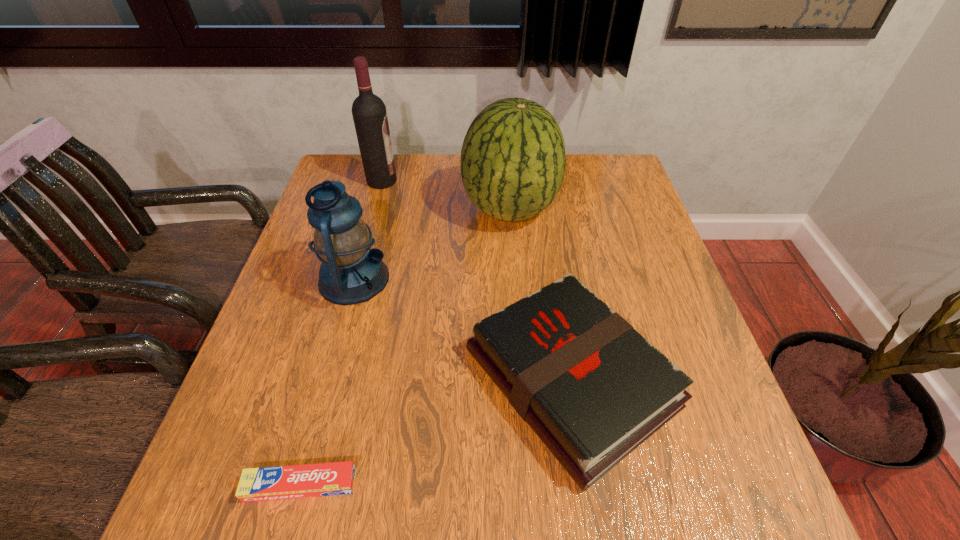
The height and width of the screenshot is (540, 960). I want to click on vacant area that lies between the fourth tallest object and the wine bottle, so click(x=476, y=280).

Find the location of a particular element. This screenshot has width=960, height=540. vacant area that lies between the shortest object and the wine bottle is located at coordinates (342, 333).

Identify the location of vacant space in between the watermelon and the lantern. tap(432, 245).

I want to click on free area in between the shortest object and the hardback book, so click(x=436, y=432).

What are the coordinates of `free space between the wine bottle and the shortest object` in the screenshot? It's located at (342, 333).

Locate which object is the fourth closest to the lantern. Please provide its 2D coordinates. Your answer should be formatted as a tuple, i.e. [(x, y)], where the tuple contains the x and y coordinates of a point satisfying the conditions above.

[(336, 478)]

Where is `the second closest object relative to the second shortest object`? the second closest object relative to the second shortest object is located at coordinates (351, 272).

Identify the location of vacant space that satisfies the following two spatial constraints: 1. on the face of the lantern; 2. on the left side of the toothpaste. (298, 485).

I want to click on free space that satisfies the following two spatial constraints: 1. on the label of the wine bottle; 2. on the left side of the watermelon, so click(x=374, y=210).

The width and height of the screenshot is (960, 540). Identify the location of free space in the image that satisfies the following two spatial constraints: 1. on the back side of the fourth tallest object; 2. on the face of the lantern. (554, 279).